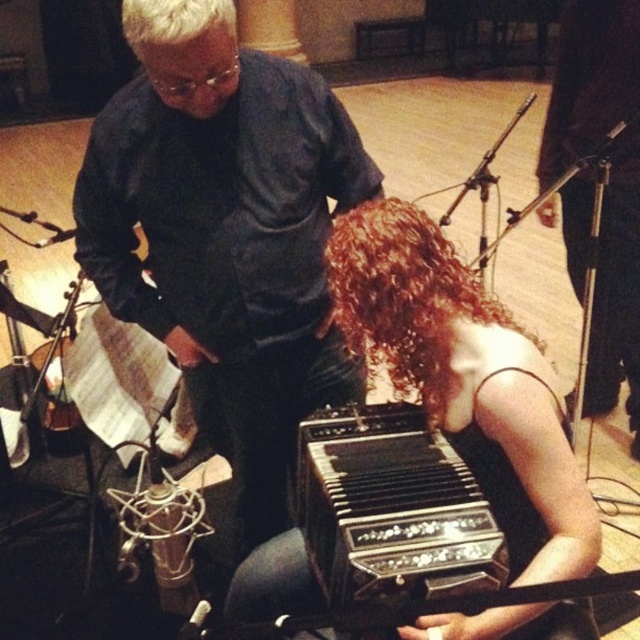
Is point (595, 552) closer to viewer compared to point (390, 589)?

No, it is not.

Does shiny black accordion at center have a greater height compared to black polished wood accordion at lower center?

Yes, shiny black accordion at center is taller than black polished wood accordion at lower center.

Locate an element on the screen. Image resolution: width=640 pixels, height=640 pixels. shiny black accordion at center is located at coordinates (467, 380).

Can you confirm if dark blue shirt at upper center is positioned to the right of shiny black accordion at center?

No, dark blue shirt at upper center is not to the right of shiny black accordion at center.

Where is `dark blue shirt at upper center`? dark blue shirt at upper center is located at coordinates (225, 232).

What are the coordinates of `dark blue shirt at upper center` in the screenshot? It's located at (225, 232).

Who is positioned more to the left, dark blue shirt at upper center or black polished wood accordion at lower center?

dark blue shirt at upper center

Which is more to the right, dark blue shirt at upper center or black polished wood accordion at lower center?

Positioned to the right is black polished wood accordion at lower center.

Which is in front, point (289, 161) or point (387, 604)?

Point (387, 604) is more forward.

Where is `dark blue shirt at upper center`? dark blue shirt at upper center is located at coordinates (225, 232).